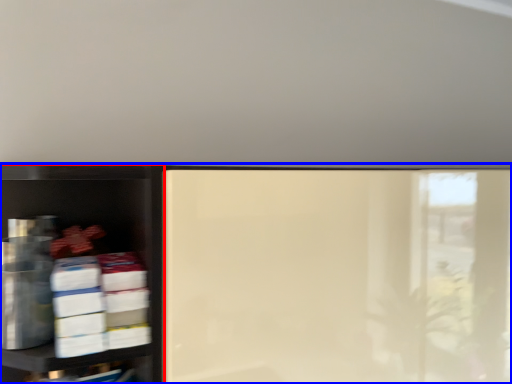
Question: Which of the following is the closest to the observer, shelf (highlighted by a red box) or shelf (highlighted by a blue box)?

Choices:
 (A) shelf
 (B) shelf

Answer: (A)